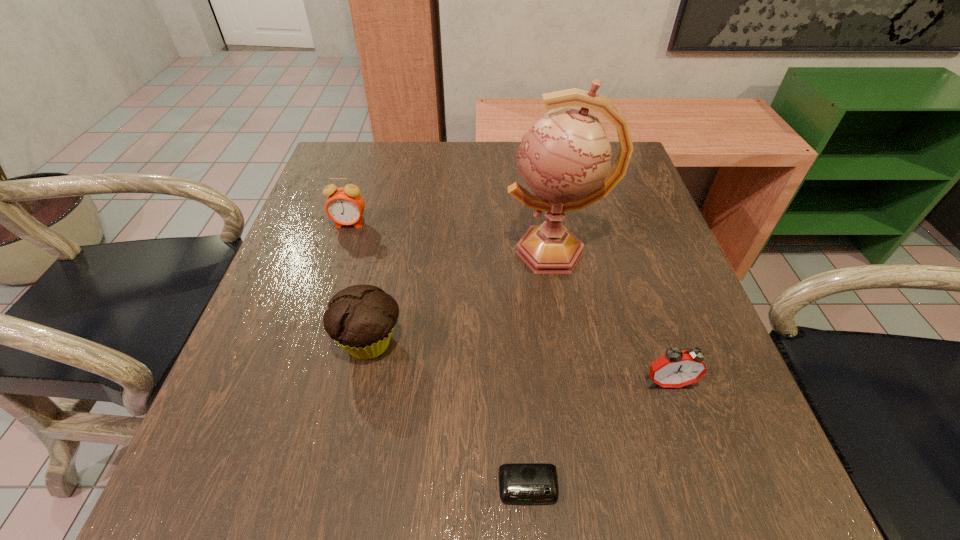
The height and width of the screenshot is (540, 960). I want to click on the tallest object, so click(565, 158).

Where is `the leftmost object`? Image resolution: width=960 pixels, height=540 pixels. the leftmost object is located at coordinates (345, 206).

You are a GUI agent. You are given a task and a screenshot of the screen. Output one action in this format:
    pyautogui.click(x=<x>, y=<y>)
    Task: Click on the farthest alarm clock
    This screenshot has height=540, width=960.
    Given the screenshot: What is the action you would take?
    pyautogui.click(x=345, y=206)

Where is `muffin`? The height and width of the screenshot is (540, 960). muffin is located at coordinates (360, 318).

At what (x,y) coordinates should I click in order to perform the action: click on the third farthest object. Please return your answer as a coordinate pair (x, y). The height and width of the screenshot is (540, 960). Looking at the image, I should click on (360, 318).

The image size is (960, 540). In order to click on the second nearest object in this screenshot , I will do `click(675, 369)`.

You are a GUI agent. You are given a task and a screenshot of the screen. Output one action in this format:
    pyautogui.click(x=<x>, y=<y>)
    Task: Click on the second tallest alarm clock
    The image size is (960, 540).
    Given the screenshot: What is the action you would take?
    pyautogui.click(x=675, y=369)

You are a GUI agent. You are given a task and a screenshot of the screen. Output one action in this format:
    pyautogui.click(x=<x>, y=<y>)
    Task: Click on the second alarm clock from left to right
    This screenshot has width=960, height=540.
    Given the screenshot: What is the action you would take?
    pyautogui.click(x=519, y=483)

Find the location of a particular element. This screenshot has height=540, width=960. the shortest alarm clock is located at coordinates (519, 483).

Identify the location of free space located on the front-facing side of the tallest object. This screenshot has width=960, height=540. (453, 252).